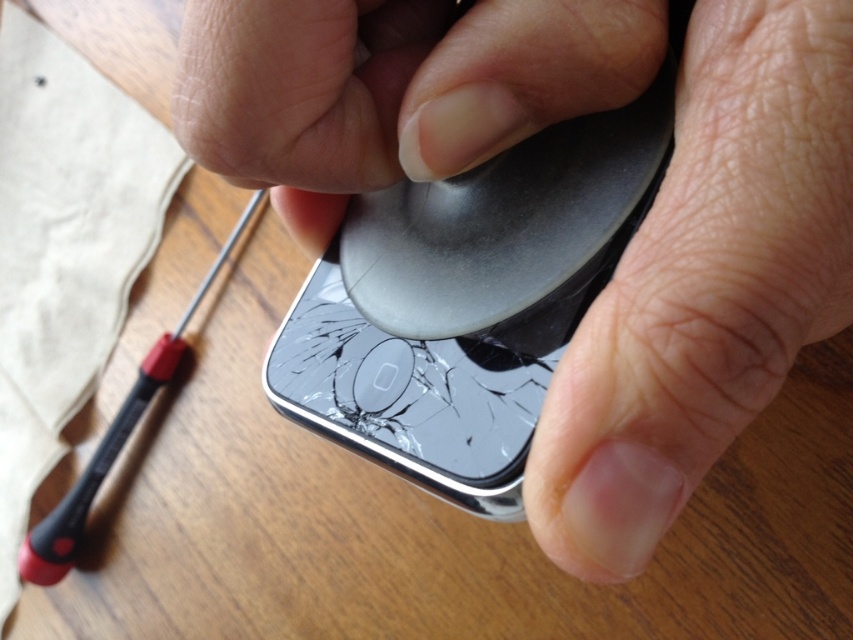
Can you confirm if metallic gray phone at center is taller than smooth matte black phone at center?

Indeed, metallic gray phone at center has a greater height compared to smooth matte black phone at center.

Does metallic gray phone at center appear under smooth matte black phone at center?

Indeed, metallic gray phone at center is positioned under smooth matte black phone at center.

Does point (792, 256) come in front of point (514, 99)?

Yes.

Find the location of `metallic gray phone at center`. metallic gray phone at center is located at coordinates (705, 284).

Does point (485, 3) come in front of point (12, 298)?

Yes.

Locate an element on the screen. The image size is (853, 640). metallic gray phone at center is located at coordinates (705, 284).

This screenshot has width=853, height=640. What do you see at coordinates (705, 284) in the screenshot?
I see `metallic gray phone at center` at bounding box center [705, 284].

The width and height of the screenshot is (853, 640). Identify the location of metallic gray phone at center. pos(705,284).

Is smooth matte black phone at center above beige fabric at upper left?

No, smooth matte black phone at center is not above beige fabric at upper left.

Locate an element on the screen. This screenshot has width=853, height=640. smooth matte black phone at center is located at coordinates tap(392, 88).

Does point (431, 172) come behind point (82, 118)?

That is False.

Locate an element on the screen. Image resolution: width=853 pixels, height=640 pixels. smooth matte black phone at center is located at coordinates (392, 88).